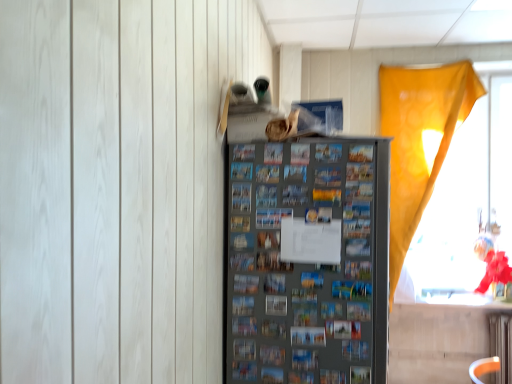
Question: From a real-world perspective, is metallic gray fridge at center over translucent yellow curtain at right?

Choices:
 (A) yes
 (B) no

Answer: (B)

Question: Is translucent yellow curtain at right inside metallic gray fridge at center?

Choices:
 (A) no
 (B) yes

Answer: (A)

Question: Considering the relative sizes of metallic gray fridge at center and translucent yellow curtain at right in the image provided, is metallic gray fridge at center thinner than translucent yellow curtain at right?

Choices:
 (A) no
 (B) yes

Answer: (A)

Question: Is metallic gray fridge at center shorter than translucent yellow curtain at right?

Choices:
 (A) no
 (B) yes

Answer: (B)

Question: Is metallic gray fridge at center wider than translucent yellow curtain at right?

Choices:
 (A) yes
 (B) no

Answer: (A)

Question: Can you confirm if metallic gray fridge at center is bigger than translucent yellow curtain at right?

Choices:
 (A) no
 (B) yes

Answer: (B)

Question: Is translucent yellow curtain at right positioned beyond the bounds of metallic gray fridge at center?

Choices:
 (A) no
 (B) yes

Answer: (B)

Question: Can you confirm if translucent yellow curtain at right is thinner than metallic gray fridge at center?

Choices:
 (A) no
 (B) yes

Answer: (B)

Question: Can you confirm if translucent yellow curtain at right is bigger than metallic gray fridge at center?

Choices:
 (A) no
 (B) yes

Answer: (A)

Question: Could metallic gray fridge at center be considered to be inside translucent yellow curtain at right?

Choices:
 (A) no
 (B) yes

Answer: (A)

Question: Is translucent yellow curtain at right with metallic gray fridge at center?

Choices:
 (A) no
 (B) yes

Answer: (A)

Question: Is translucent yellow curtain at right shorter than metallic gray fridge at center?

Choices:
 (A) yes
 (B) no

Answer: (B)

Question: Choose the correct answer: Is translucent yellow curtain at right inside metallic gray fridge at center or outside it?

Choices:
 (A) outside
 (B) inside

Answer: (A)